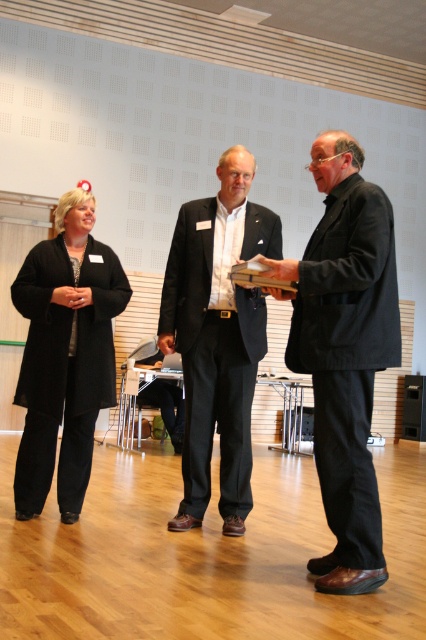
Question: Can you confirm if dark gray suit at center is positioned to the right of black matte suit at center?

Choices:
 (A) no
 (B) yes

Answer: (B)

Question: Which point is farther to the camera?

Choices:
 (A) black fabric coat at left
 (B) dark gray suit at center

Answer: (A)

Question: Can you confirm if black matte suit at center is wider than black fabric coat at left?

Choices:
 (A) yes
 (B) no

Answer: (A)

Question: Can you confirm if black matte suit at center is bigger than black fabric coat at left?

Choices:
 (A) no
 (B) yes

Answer: (B)

Question: Which point is closer to the camera?

Choices:
 (A) (117, 284)
 (B) (198, 387)
 (C) (397, 342)

Answer: (C)

Question: Among these objects, which one is farthest from the camera?

Choices:
 (A) black matte suit at center
 (B) dark gray suit at center
 (C) black fabric coat at left

Answer: (C)